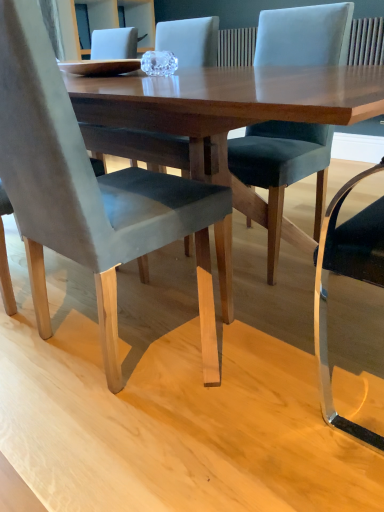
Question: Considering the positions of velvet grey chair at lower left, which is the second chair from right to left, and velvet dark gray chair at center, the 1th chair in the right-to-left sequence, in the image, is velvet grey chair at lower left, which is the second chair from right to left, taller or shorter than velvet dark gray chair at center, the 1th chair in the right-to-left sequence,?

Choices:
 (A) tall
 (B) short

Answer: (A)

Question: Considering their positions, is velvet grey chair at lower left, which is the 1th chair in left-to-right order, located in front of or behind velvet dark gray chair at center, the 1th chair in the right-to-left sequence?

Choices:
 (A) front
 (B) behind

Answer: (A)

Question: Is velvet grey chair at lower left, which is the 1th chair in left-to-right order, inside or outside of velvet dark gray chair at center, the second chair viewed from the left?

Choices:
 (A) inside
 (B) outside

Answer: (B)

Question: In the image, is velvet dark gray chair at center, the 1th chair in the right-to-left sequence, positioned in front of or behind velvet grey chair at lower left, which is the 1th chair in left-to-right order?

Choices:
 (A) behind
 (B) front

Answer: (A)

Question: Choose the correct answer: Is velvet dark gray chair at center, the second chair viewed from the left, inside velvet grey chair at lower left, which is the second chair from right to left, or outside it?

Choices:
 (A) inside
 (B) outside

Answer: (B)

Question: In terms of height, does velvet dark gray chair at center, the 1th chair in the right-to-left sequence, look taller or shorter compared to velvet grey chair at lower left, which is the second chair from right to left?

Choices:
 (A) short
 (B) tall

Answer: (A)

Question: Would you say velvet dark gray chair at center, the 1th chair in the right-to-left sequence, is to the left or to the right of velvet grey chair at lower left, which is the 1th chair in left-to-right order, in the picture?

Choices:
 (A) right
 (B) left

Answer: (A)